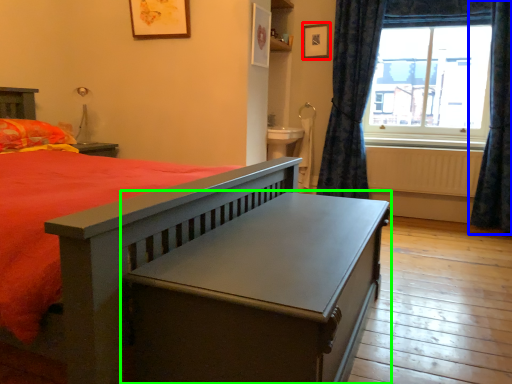
Question: Estimate the real-world distances between objects in this image. Which object is closer to picture frame (highlighted by a red box), curtain (highlighted by a blue box) or table (highlighted by a green box)?

Choices:
 (A) curtain
 (B) table

Answer: (A)